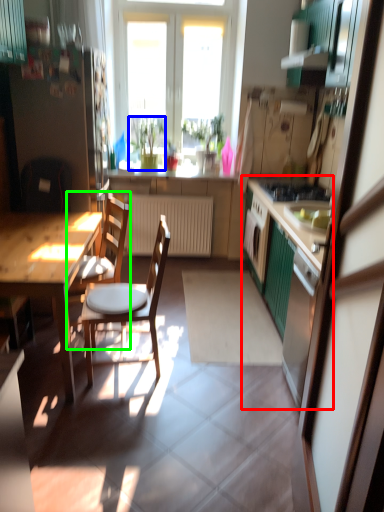
Question: Which object is the farthest from cabinetry (highlighted by a red box)? Choose among these: houseplant (highlighted by a blue box) or chair (highlighted by a green box).

Choices:
 (A) houseplant
 (B) chair

Answer: (A)